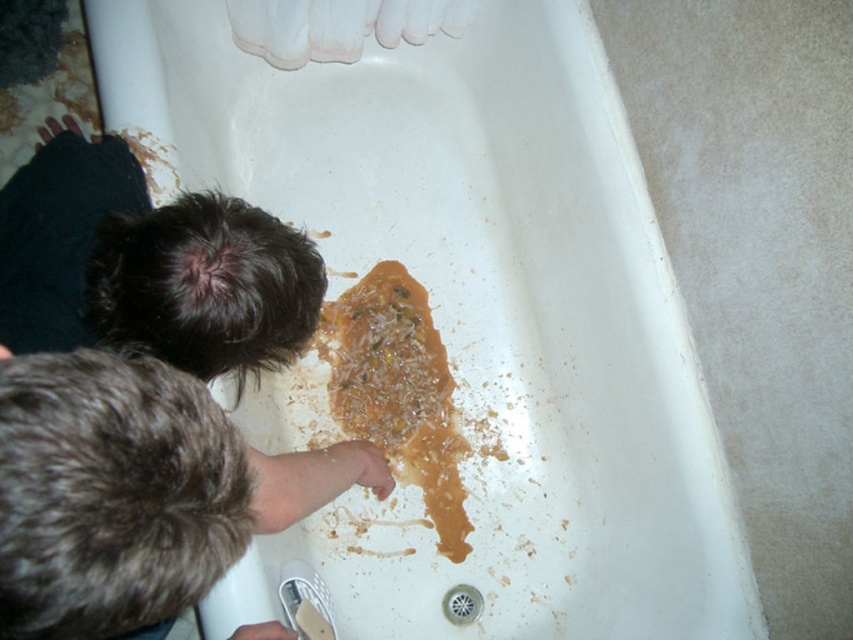
Question: Is dark brown fur at upper left closer to the viewer compared to brown crumbly food at center?

Choices:
 (A) no
 (B) yes

Answer: (B)

Question: Is dark brown fur at upper left wider than brown crumbly food at center?

Choices:
 (A) no
 (B) yes

Answer: (B)

Question: Which point is farther to the camera?

Choices:
 (A) (349, 410)
 (B) (135, 176)

Answer: (A)

Question: Considering the relative positions of dark brown fur at upper left and brown crumbly food at center in the image provided, where is dark brown fur at upper left located with respect to brown crumbly food at center?

Choices:
 (A) above
 (B) below

Answer: (A)

Question: Which point is farther from the camera taking this photo?

Choices:
 (A) (20, 192)
 (B) (428, 369)

Answer: (B)